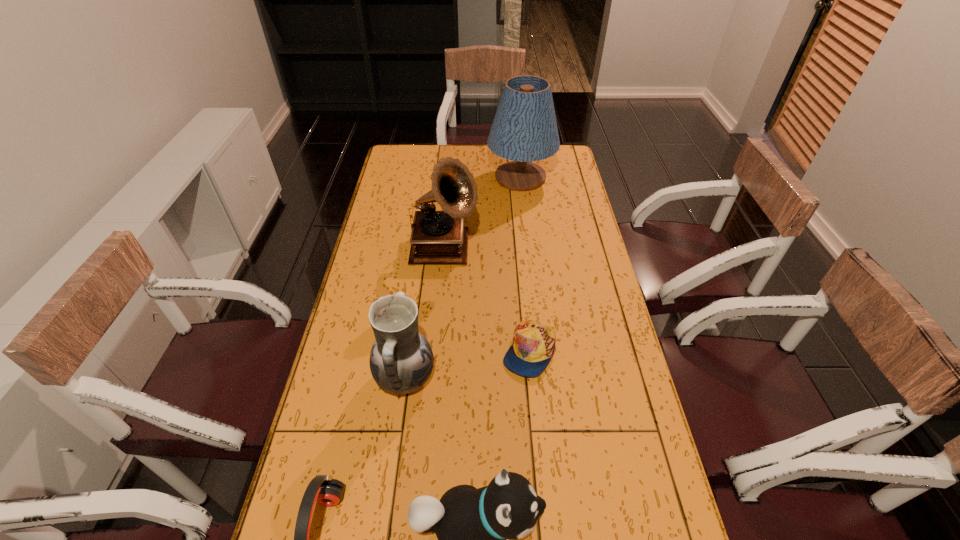
I want to click on object that is at the right edge, so (524, 130).

The image size is (960, 540). In order to click on object that is at the far right corner in this screenshot , I will do `click(524, 130)`.

The height and width of the screenshot is (540, 960). In the image, there is a desktop. Find the location of `vacant space at the left edge`. vacant space at the left edge is located at coordinates (396, 255).

Where is `blank space at the right edge of the desktop`? This screenshot has width=960, height=540. blank space at the right edge of the desktop is located at coordinates (638, 476).

This screenshot has height=540, width=960. I want to click on vacant area that lies between the fourth shortest object and the lampshade, so click(x=463, y=278).

I want to click on empty location between the cap and the record player, so click(x=487, y=301).

Where is `free space between the pitcher and the fifth nearest object`? free space between the pitcher and the fifth nearest object is located at coordinates (425, 314).

Select which object appears as the fourth closest to the fourth shortest object. Please provide its 2D coordinates. Your answer should be formatted as a tuple, i.e. [(x, y)], where the tuple contains the x and y coordinates of a point satisfying the conditions above.

[(438, 237)]

This screenshot has height=540, width=960. In order to click on object that is the closest to the lampshade in this screenshot , I will do `click(438, 237)`.

At what (x,y) coordinates should I click in order to perform the action: click on free spot that satisfies the following two spatial constraints: 1. on the bill of the shortest object; 2. on the front-facing side of the fourth shortest object. Please return your answer as a coordinate pair (x, y). Looking at the image, I should click on (531, 378).